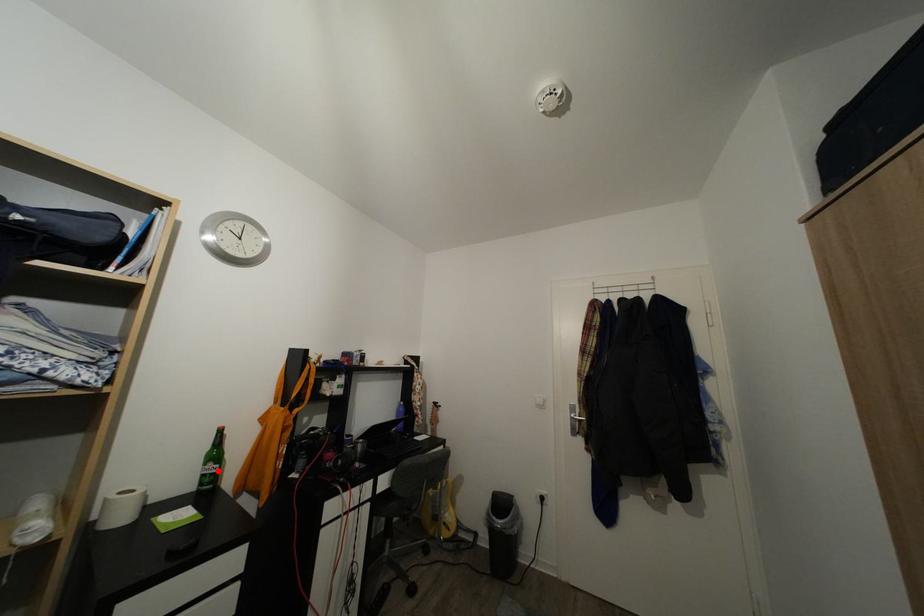
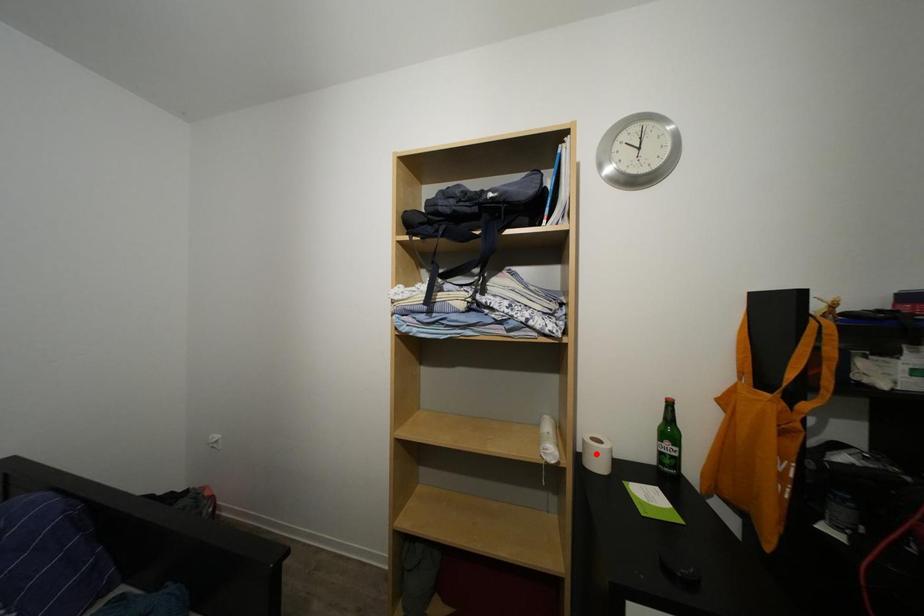
I am providing you with two images of the same scene from different viewpoints. A red point is marked on the first image and another point is marked on the second image. Do the highlighted points in image1 and image2 indicate the same real-world spot?

No